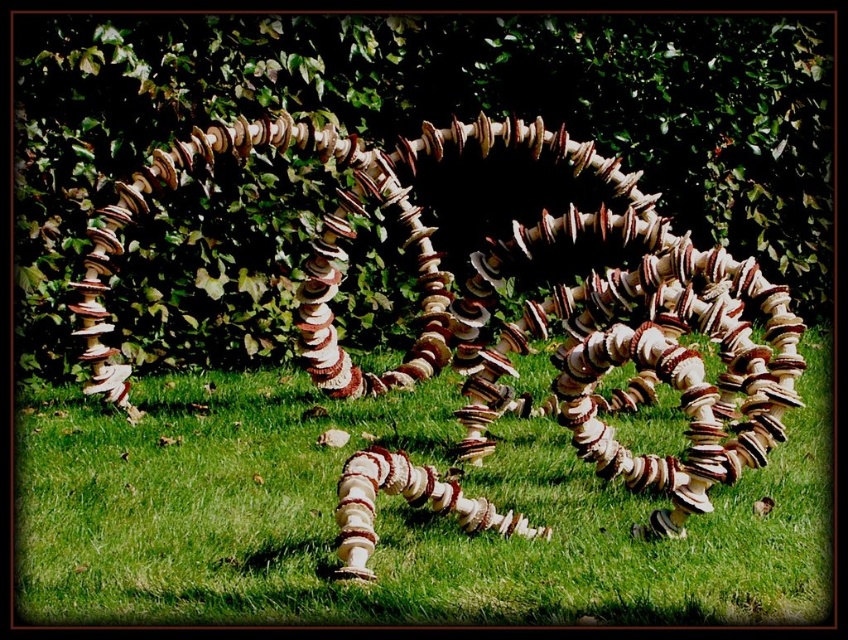
Question: Among these objects, which one is nearest to the camera?

Choices:
 (A) white textured mushrooms at center
 (B) green leafy hedge at center

Answer: (A)

Question: Among these points, which one is farthest from the camera?

Choices:
 (A) (160, 531)
 (B) (780, 83)

Answer: (B)

Question: Can you confirm if green leafy hedge at center is smaller than white textured mushrooms at center?

Choices:
 (A) no
 (B) yes

Answer: (A)

Question: Can you confirm if green leafy hedge at center is thinner than white textured mushrooms at center?

Choices:
 (A) yes
 (B) no

Answer: (B)

Question: Can you confirm if green leafy hedge at center is smaller than white textured mushrooms at center?

Choices:
 (A) no
 (B) yes

Answer: (A)

Question: Which object is closer to the camera taking this photo?

Choices:
 (A) green leafy hedge at center
 (B) white textured mushrooms at center

Answer: (B)